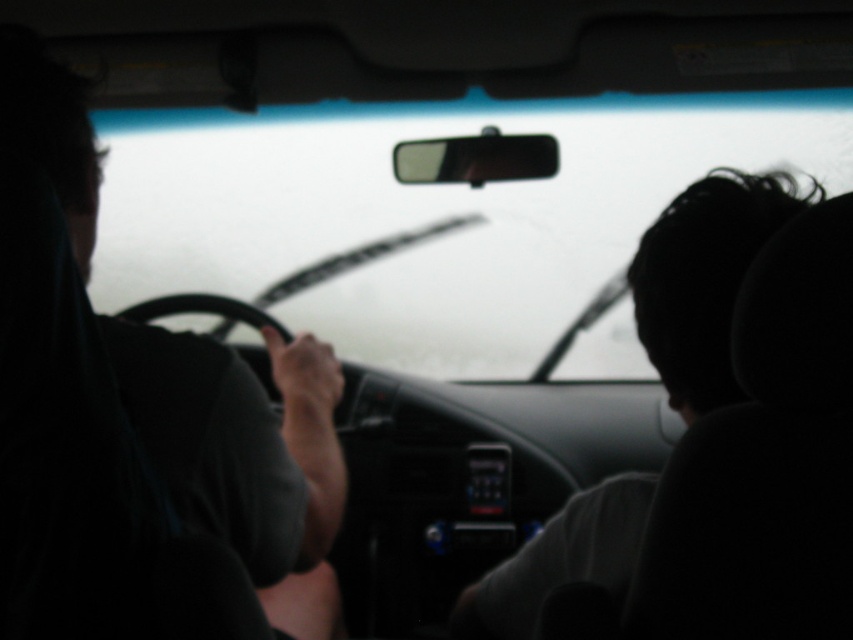
Question: Is transparent glass windshield at center above dark matte shirt at left?

Choices:
 (A) yes
 (B) no

Answer: (A)

Question: Which object appears closest to the camera in this image?

Choices:
 (A) dark matte shirt at left
 (B) transparent glass windshield at center
 (C) dark hair at right

Answer: (A)

Question: Among these points, which one is nearest to the camera?

Choices:
 (A) (241, 376)
 (B) (651, 237)
 (C) (172, 257)

Answer: (A)

Question: Is transparent glass windshield at center positioned behind dark matte shirt at left?

Choices:
 (A) yes
 (B) no

Answer: (A)

Question: Which is nearer to the dark matte shirt at left?

Choices:
 (A) dark hair at right
 (B) transparent glass windshield at center

Answer: (A)

Question: Can you confirm if dark matte shirt at left is wider than dark hair at right?

Choices:
 (A) no
 (B) yes

Answer: (A)